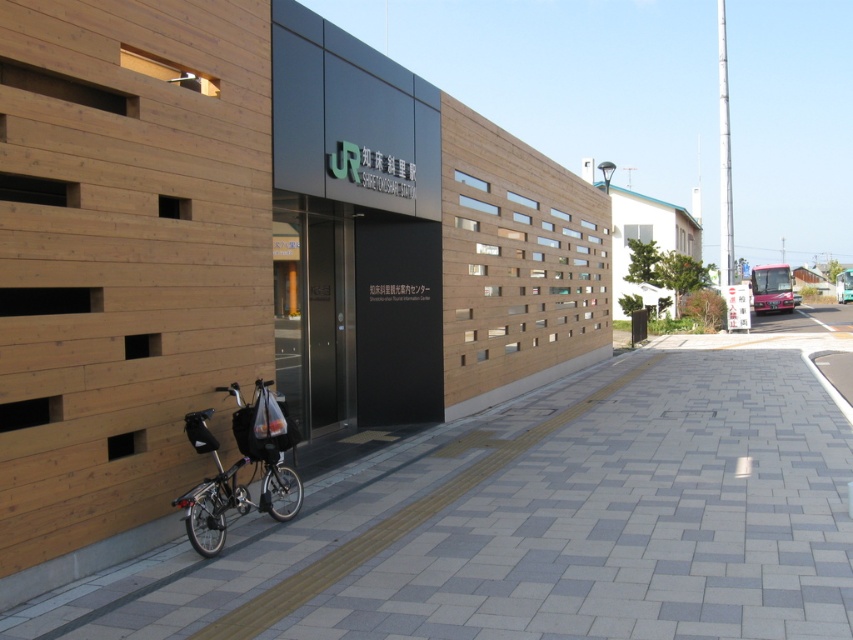
Question: Is gray concrete pavement at center thinner than shiny black bicycle at lower left?

Choices:
 (A) yes
 (B) no

Answer: (B)

Question: Does gray concrete pavement at center have a greater width compared to shiny black bicycle at lower left?

Choices:
 (A) no
 (B) yes

Answer: (B)

Question: Does gray concrete pavement at center come in front of shiny black bicycle at lower left?

Choices:
 (A) yes
 (B) no

Answer: (A)

Question: Which object appears closest to the camera in this image?

Choices:
 (A) shiny black bicycle at lower left
 (B) gray concrete pavement at center

Answer: (B)

Question: Which object is closer to the camera taking this photo?

Choices:
 (A) gray concrete pavement at center
 (B) shiny black bicycle at lower left

Answer: (A)